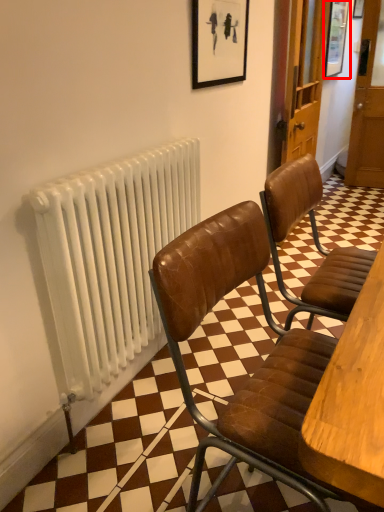
Question: From the image's perspective, considering the relative positions of picture frame (annotated by the red box) and radiator in the image provided, where is picture frame (annotated by the red box) located with respect to the staircase?

Choices:
 (A) below
 (B) above

Answer: (B)